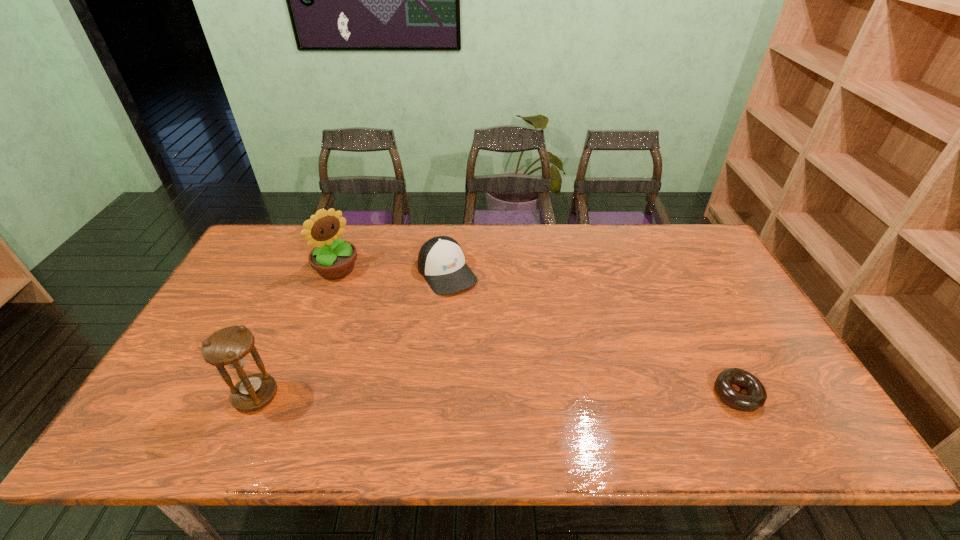
This screenshot has width=960, height=540. I want to click on free space on the desktop that is between the hourglass and the rightmost object and is positioned on the face of the sunflower, so click(477, 395).

Find the location of a particular element. The image size is (960, 540). vacant spot on the desktop that is between the hourglass and the shortest object and is positioned on the front panel of the cap is located at coordinates (540, 395).